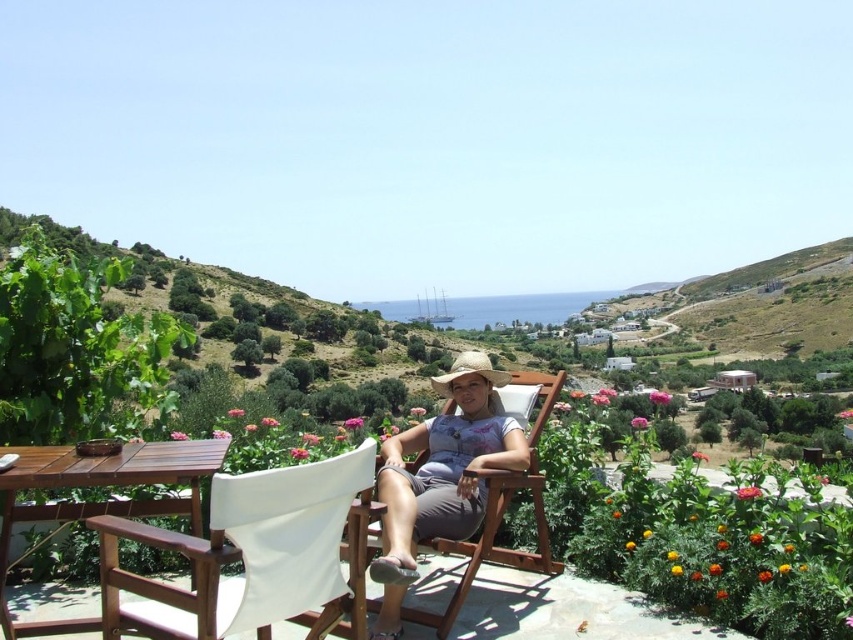
Is white canvas beach chair at lower center closer to the viewer compared to matte straw hat at center?

Yes, it is in front of matte straw hat at center.

Does white canvas beach chair at lower center have a smaller size compared to matte straw hat at center?

Yes.

Is point (318, 522) positioned in front of point (457, 381)?

Yes, it is.

Where is `white canvas beach chair at lower center`? Image resolution: width=853 pixels, height=640 pixels. white canvas beach chair at lower center is located at coordinates (247, 554).